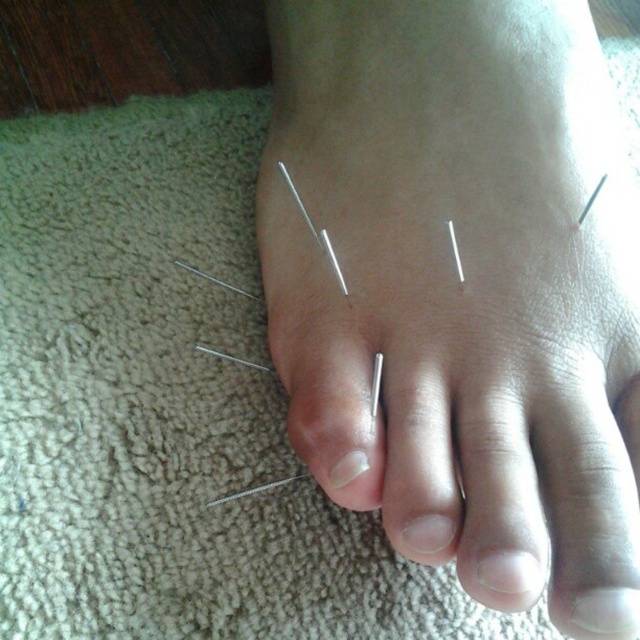
Question: Considering the relative positions of white matte nail at center and metallic silver nail at center in the image provided, where is white matte nail at center located with respect to metallic silver nail at center?

Choices:
 (A) above
 (B) below

Answer: (B)

Question: Which object is closer to the camera taking this photo?

Choices:
 (A) metallic silver nail at center
 (B) silver metallic needles at center

Answer: (B)

Question: Which point is closer to the camera taking this photo?

Choices:
 (A) (413, 540)
 (B) (307, 444)

Answer: (A)

Question: Can you confirm if metallic silver nail at center is thinner than white glossy nail at center?

Choices:
 (A) no
 (B) yes

Answer: (A)

Question: Does white matte nail at center appear on the right side of white glossy nail at center?

Choices:
 (A) yes
 (B) no

Answer: (A)

Question: Which object is closer to the camera taking this photo?

Choices:
 (A) metallic silver toe at center
 (B) white matte nail at center
 (C) white glossy nail at center

Answer: (A)